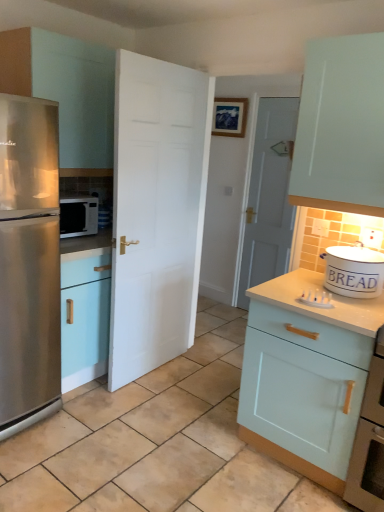
This screenshot has height=512, width=384. In order to click on free space to the left of light blue wood cabinet at right, which is counted as the first cabinetry, starting from the right in this screenshot , I will do `click(198, 437)`.